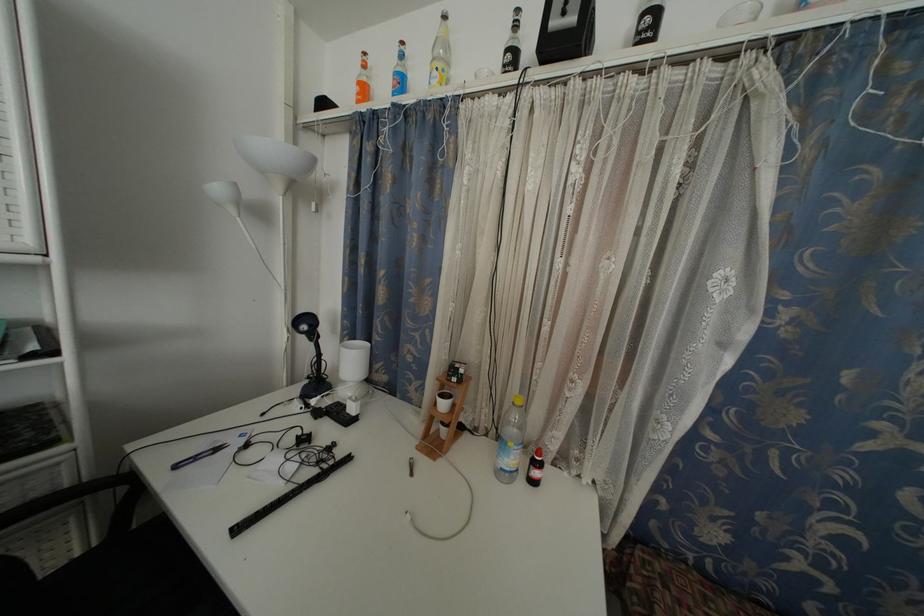
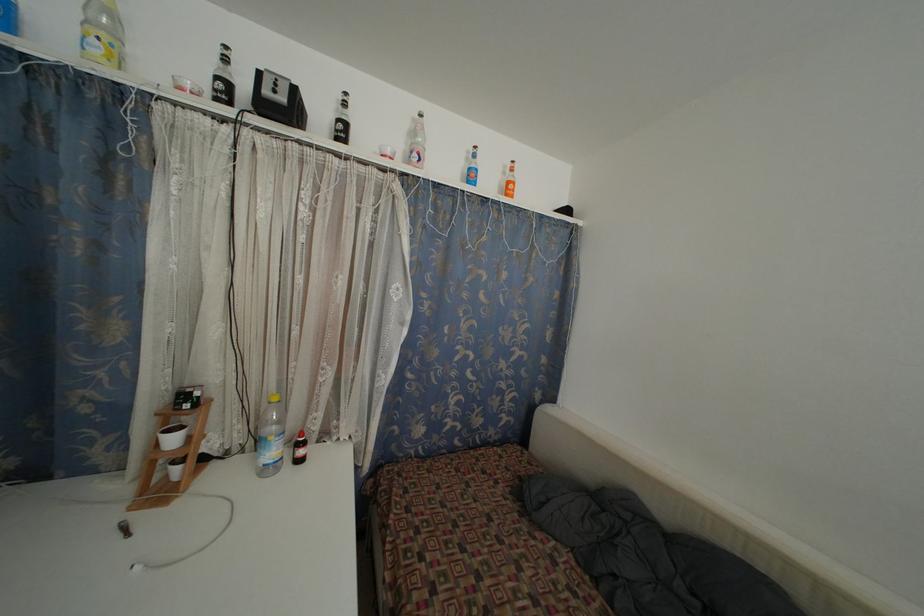
Find the pixel in the second image that matches (515,450) in the first image.

(274, 444)